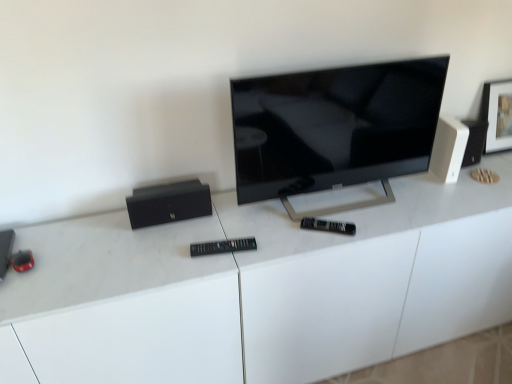
You are a GUI agent. You are given a task and a screenshot of the screen. Output one action in this format:
    pyautogui.click(x=<x>, y=<y>)
    Task: Click on the free location in front of black matte speaker at left, the 2th speaker from the left
    This screenshot has height=384, width=512.
    Given the screenshot: What is the action you would take?
    pyautogui.click(x=160, y=249)